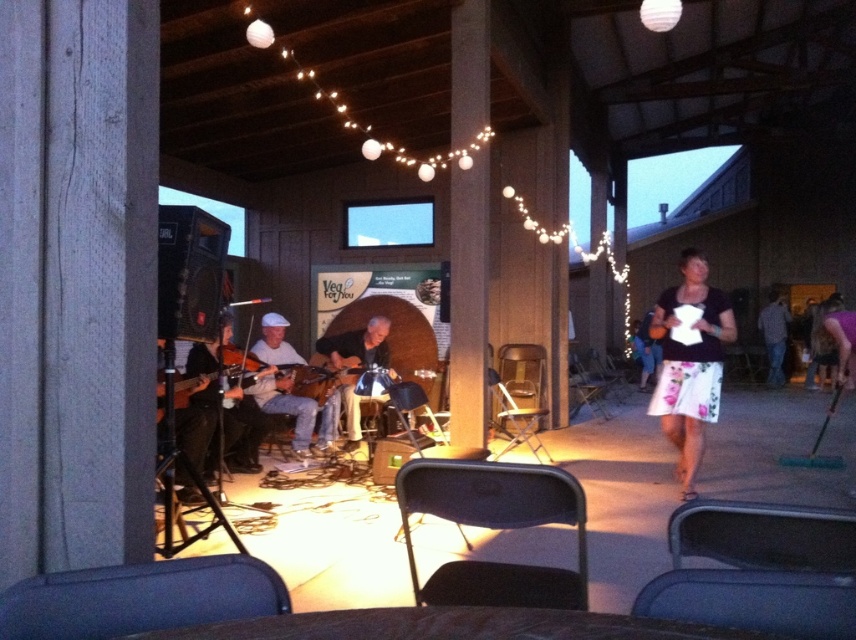
Which is above, floral skirt at right or matte brown guitar at center?

floral skirt at right is higher up.

Does point (691, 252) come in front of point (262, 336)?

Yes, point (691, 252) is in front of point (262, 336).

Identify the location of floral skirt at right. Image resolution: width=856 pixels, height=640 pixels. (690, 364).

You are a GUI agent. You are given a task and a screenshot of the screen. Output one action in this format:
    pyautogui.click(x=<x>, y=<y>)
    Task: Click on the matte brown guitar at center
    The width and height of the screenshot is (856, 640).
    Given the screenshot: What is the action you would take?
    pyautogui.click(x=296, y=412)

Is point (314, 424) positioned after point (372, 356)?

No, it is in front of (372, 356).

Where is `matte brown guitar at center`? The width and height of the screenshot is (856, 640). matte brown guitar at center is located at coordinates (296, 412).

Between floral skirt at right and wooden acoustic guitar at center, which one is positioned higher?

floral skirt at right

What do you see at coordinates (690, 364) in the screenshot? I see `floral skirt at right` at bounding box center [690, 364].

Which is in front, point (682, 429) or point (339, 342)?

Positioned in front is point (682, 429).

At what (x,y) coordinates should I click in order to perform the action: click on floral skirt at right. Please return your answer as a coordinate pair (x, y). This screenshot has width=856, height=640. Looking at the image, I should click on (690, 364).